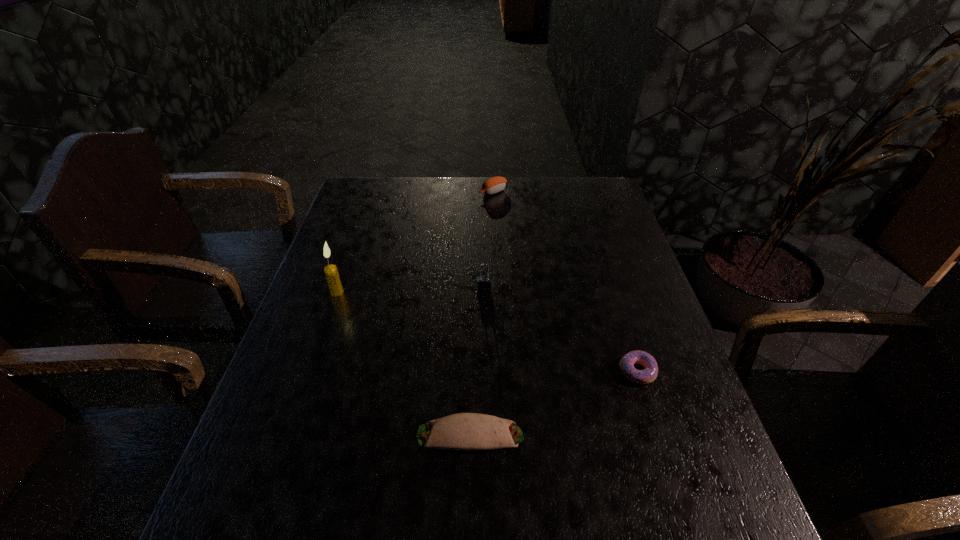
Locate an element on the screen. This screenshot has height=540, width=960. free point between the tallest object and the second nearest object is located at coordinates (487, 332).

The width and height of the screenshot is (960, 540). Identify the location of free space between the candle and the third tallest object. (415, 242).

In order to click on object that is the fourth nearest to the leftmost object in this screenshot , I will do `click(649, 374)`.

Locate which object ranks third in proximity to the leftmost object. Please provide its 2D coordinates. Your answer should be formatted as a tuple, i.e. [(x, y)], where the tuple contains the x and y coordinates of a point satisfying the conditions above.

[(493, 185)]

Where is `vacant space that satisfies the following two spatial constraints: 1. on the shackle of the rightmost object; 2. on the left side of the fourth shortest object`? vacant space that satisfies the following two spatial constraints: 1. on the shackle of the rightmost object; 2. on the left side of the fourth shortest object is located at coordinates (485, 371).

I want to click on free location that satisfies the following two spatial constraints: 1. on the shackle of the padlock; 2. at the bitten end of the nearest object, so click(x=486, y=435).

This screenshot has width=960, height=540. Find the location of `free space that satisfies the following two spatial constraints: 1. on the front side of the rightmost object; 2. on the right side of the tallest object`. free space that satisfies the following two spatial constraints: 1. on the front side of the rightmost object; 2. on the right side of the tallest object is located at coordinates (310, 371).